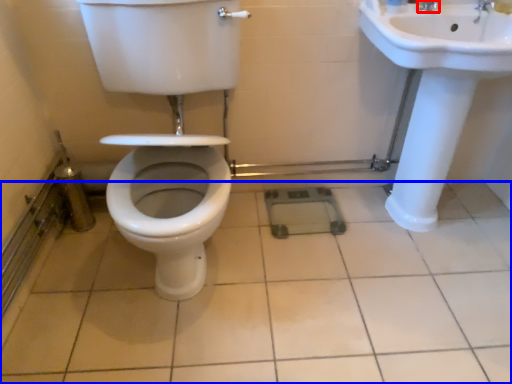
Question: Which object is further to the camera taking this photo, tap (highlighted by a red box) or ceramic tile (highlighted by a blue box)?

Choices:
 (A) tap
 (B) ceramic tile

Answer: (A)